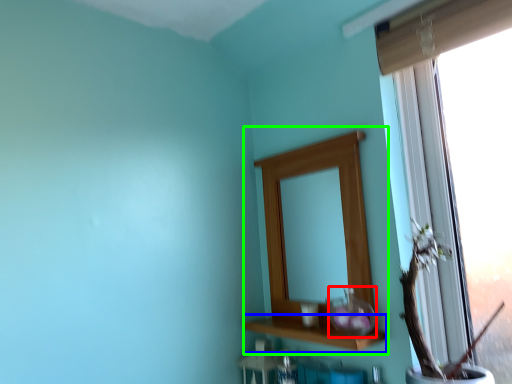
Question: Considering the real-world distances, which object is closest to glass vase (highlighted by a red box)? window sill (highlighted by a blue box) or medicine cabinet (highlighted by a green box).

Choices:
 (A) window sill
 (B) medicine cabinet

Answer: (A)